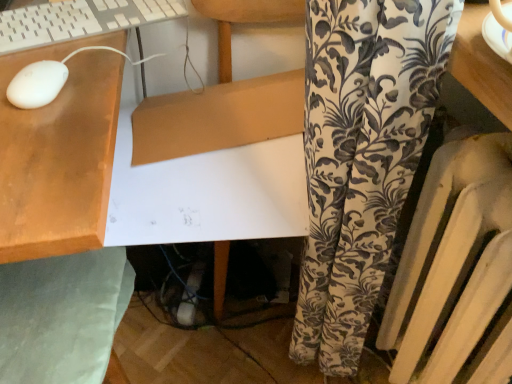
The image size is (512, 384). What do you see at coordinates (78, 20) in the screenshot? I see `white plastic keyboard at upper left` at bounding box center [78, 20].

Where is `white plastic radiator at right`? This screenshot has height=384, width=512. white plastic radiator at right is located at coordinates (440, 214).

Locate an element on the screen. white matte mouse at upper left is located at coordinates (37, 84).

At what (x,y) coordinates should I click in order to perform the action: click on green fabric swivel chair at lower left. Please return your answer as a coordinate pair (x, y). The height and width of the screenshot is (384, 512). Looking at the image, I should click on (62, 316).

The image size is (512, 384). I want to click on white plastic keyboard at upper left, so click(78, 20).

Is white matte mouse at upper left at the back of white plastic keyboard at upper left?

That's not correct — white plastic keyboard at upper left is not looking away from white matte mouse at upper left.

Visually, is white plastic keyboard at upper left positioned to the left or to the right of white matte mouse at upper left?

From the image, it's evident that white plastic keyboard at upper left is to the left of white matte mouse at upper left.

Looking at this image, in terms of size, does white plastic keyboard at upper left appear bigger or smaller than white matte mouse at upper left?

In the image, white plastic keyboard at upper left appears to be larger than white matte mouse at upper left.

From the image's perspective, is white plastic keyboard at upper left under white matte mouse at upper left?

Actually, white plastic keyboard at upper left appears above white matte mouse at upper left in the image.

Can you confirm if white plastic radiator at right is bigger than white plastic keyboard at upper left?

Indeed, white plastic radiator at right has a larger size compared to white plastic keyboard at upper left.

Choose the correct answer: Is white plastic radiator at right inside white plastic keyboard at upper left or outside it?

white plastic radiator at right is spatially situated outside white plastic keyboard at upper left.

Can you confirm if white plastic radiator at right is shorter than white plastic keyboard at upper left?

Incorrect, the height of white plastic radiator at right does not fall short of that of white plastic keyboard at upper left.

From the image's perspective, which object appears higher, white plastic radiator at right or white plastic keyboard at upper left?

Answer: white plastic keyboard at upper left is shown above in the image.

Does green fabric swivel chair at lower left have a greater height compared to white matte mouse at upper left?

Correct, green fabric swivel chair at lower left is much taller as white matte mouse at upper left.

Looking at this image, are green fabric swivel chair at lower left and white matte mouse at upper left far apart?

No, there isn't a large distance between green fabric swivel chair at lower left and white matte mouse at upper left.

Which object is closer to the camera, green fabric swivel chair at lower left or white matte mouse at upper left?

green fabric swivel chair at lower left is more forward.

From a real-world perspective, who is located lower, green fabric swivel chair at lower left or white matte mouse at upper left?

In real-world perspective, green fabric swivel chair at lower left is lower.

Does white plastic radiator at right contain green fabric swivel chair at lower left?

No.

Can you confirm if white plastic radiator at right is thinner than green fabric swivel chair at lower left?

Yes, white plastic radiator at right is thinner than green fabric swivel chair at lower left.

Does point (437, 172) appear closer or farther from the camera than point (23, 276)?

Point (437, 172) is closer to the camera than point (23, 276).

Looking at this image, from a real-world perspective, between white plastic radiator at right and green fabric swivel chair at lower left, who is vertically lower?

A: From a 3D spatial view, white plastic radiator at right is below.

Considering the sizes of objects white plastic keyboard at upper left and green fabric swivel chair at lower left in the image provided, who is taller, white plastic keyboard at upper left or green fabric swivel chair at lower left?

With more height is green fabric swivel chair at lower left.

Can you tell me how much white plastic keyboard at upper left and green fabric swivel chair at lower left differ in facing direction?

165 degrees.

Which of these two, white plastic keyboard at upper left or green fabric swivel chair at lower left, is smaller?

With smaller size is white plastic keyboard at upper left.

Which is more to the left, white plastic keyboard at upper left or green fabric swivel chair at lower left?

white plastic keyboard at upper left.

Is white matte mouse at upper left to the right of green fabric swivel chair at lower left from the viewer's perspective?

Yes.

Between white matte mouse at upper left and green fabric swivel chair at lower left, which one has more height?

Standing taller between the two is green fabric swivel chair at lower left.

Looking at their sizes, would you say white matte mouse at upper left is wider or thinner than green fabric swivel chair at lower left?

Considering their sizes, white matte mouse at upper left looks slimmer than green fabric swivel chair at lower left.

Would you consider white matte mouse at upper left to be distant from green fabric swivel chair at lower left?

No, there isn't a large distance between white matte mouse at upper left and green fabric swivel chair at lower left.

In terms of width, does white matte mouse at upper left look wider or thinner when compared to white plastic radiator at right?

In the image, white matte mouse at upper left appears to be more narrow than white plastic radiator at right.

Is point (48, 90) positioned before point (511, 173)?

Yes, it is.

Is white matte mouse at upper left oriented towards white plastic radiator at right?

No, white matte mouse at upper left is not facing towards white plastic radiator at right.

This screenshot has width=512, height=384. I want to click on computer keyboard above the white matte mouse at upper left (from the image's perspective), so click(x=78, y=20).

Identify the location of computer keyboard behind the white plastic radiator at right. This screenshot has height=384, width=512. 78,20.

Considering their positions, is white matte mouse at upper left positioned further to white plastic keyboard at upper left than green fabric swivel chair at lower left?

green fabric swivel chair at lower left is further to white plastic keyboard at upper left.

Based on the photo, based on their spatial positions, is white plastic keyboard at upper left or white matte mouse at upper left closer to white plastic radiator at right?

white matte mouse at upper left is closer to white plastic radiator at right.

Which object lies nearer to the anchor point white matte mouse at upper left, white plastic radiator at right or green fabric swivel chair at lower left?

green fabric swivel chair at lower left is closer to white matte mouse at upper left.

Estimate the real-world distances between objects in this image. Which object is further from green fabric swivel chair at lower left, white plastic keyboard at upper left or white plastic radiator at right?

white plastic radiator at right lies further to green fabric swivel chair at lower left than the other object.

From the picture: Estimate the real-world distances between objects in this image. Which object is further from white plastic keyboard at upper left, white plastic radiator at right or white matte mouse at upper left?

white plastic radiator at right is positioned further to the anchor white plastic keyboard at upper left.

Which object lies nearer to the anchor point white matte mouse at upper left, white plastic keyboard at upper left or green fabric swivel chair at lower left?

The object closer to white matte mouse at upper left is white plastic keyboard at upper left.

From the image, which object appears to be farther from white plastic radiator at right, white matte mouse at upper left or white plastic keyboard at upper left?

Among the two, white plastic keyboard at upper left is located further to white plastic radiator at right.

Which object lies further to the anchor point white plastic keyboard at upper left, green fabric swivel chair at lower left or white matte mouse at upper left?

Among the two, green fabric swivel chair at lower left is located further to white plastic keyboard at upper left.

This screenshot has height=384, width=512. What are the coordinates of `mouse located between green fabric swivel chair at lower left and white plastic radiator at right in the left-right direction` in the screenshot? It's located at [x=37, y=84].

Locate an element on the screen. The height and width of the screenshot is (384, 512). mouse situated between white plastic keyboard at upper left and white plastic radiator at right from left to right is located at coordinates (37, 84).

You are a GUI agent. You are given a task and a screenshot of the screen. Output one action in this format:
    pyautogui.click(x=<x>, y=<y>)
    Task: Click on the swivel chair between white plastic keyboard at upper left and white plastic radiator at right in the horizontal direction
    This screenshot has width=512, height=384.
    Given the screenshot: What is the action you would take?
    pyautogui.click(x=62, y=316)

Identify the location of mouse between white plastic keyboard at upper left and green fabric swivel chair at lower left in the up-down direction. The image size is (512, 384). (37, 84).